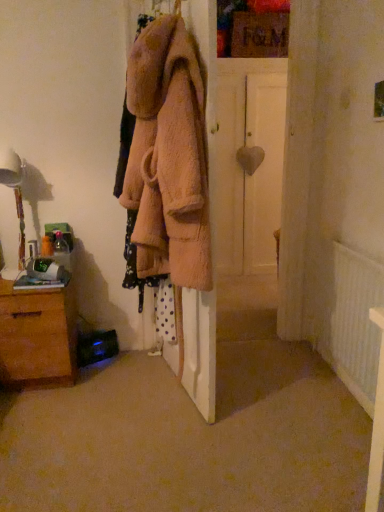
I want to click on free location to the right of brown wooden chest of drawers at lower left, so click(x=103, y=387).